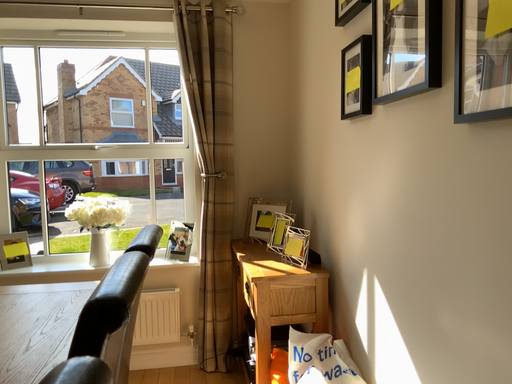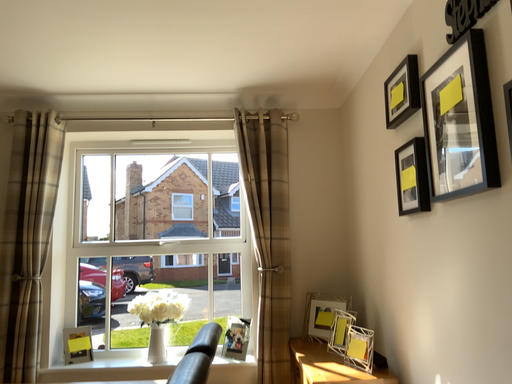
Question: How did the camera likely rotate when shooting the video?

Choices:
 (A) rotated left
 (B) rotated right

Answer: (A)